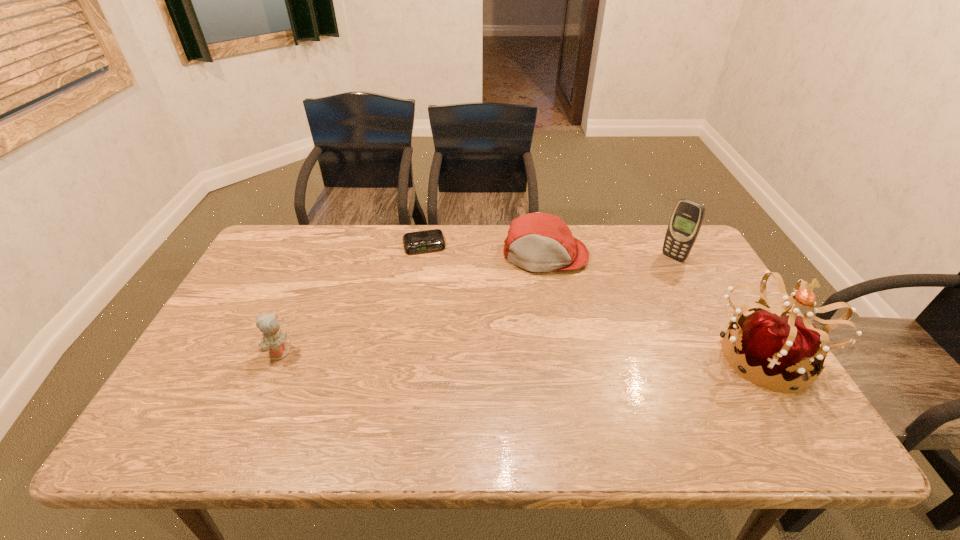
Locate an element on the screen. The width and height of the screenshot is (960, 540). free space at the far left corner of the desktop is located at coordinates (272, 233).

Find the location of a particular element. Image resolution: width=960 pixels, height=540 pixels. vacant space at the far right corner of the desktop is located at coordinates (681, 266).

In order to click on free space between the shortest object and the teddy bear in this screenshot , I will do `click(351, 299)`.

This screenshot has height=540, width=960. In order to click on vacant space that's between the fourth object from right to left and the tallest object in this screenshot , I will do `click(594, 300)`.

The height and width of the screenshot is (540, 960). In order to click on empty location between the tallest object and the cap in this screenshot , I will do `click(655, 304)`.

Where is `free space between the tiara and the leftmost object`? The image size is (960, 540). free space between the tiara and the leftmost object is located at coordinates click(521, 353).

Find the location of `vacant region between the tallest object and the cellular telephone`. vacant region between the tallest object and the cellular telephone is located at coordinates click(x=719, y=306).

Identify the location of vacant area that lies between the teddy bear and the fourth shortest object. Image resolution: width=960 pixels, height=540 pixels. tap(476, 305).

The image size is (960, 540). In order to click on vacant area that lies between the tiara and the fourth object from right to left in this screenshot , I will do `click(594, 300)`.

You are a GUI agent. You are given a task and a screenshot of the screen. Output one action in this format:
    pyautogui.click(x=<x>, y=<y>)
    Task: Click on the vacant area that lies between the fourth shortest object and the tiara
    Image resolution: width=960 pixels, height=540 pixels.
    Given the screenshot: What is the action you would take?
    pyautogui.click(x=719, y=306)